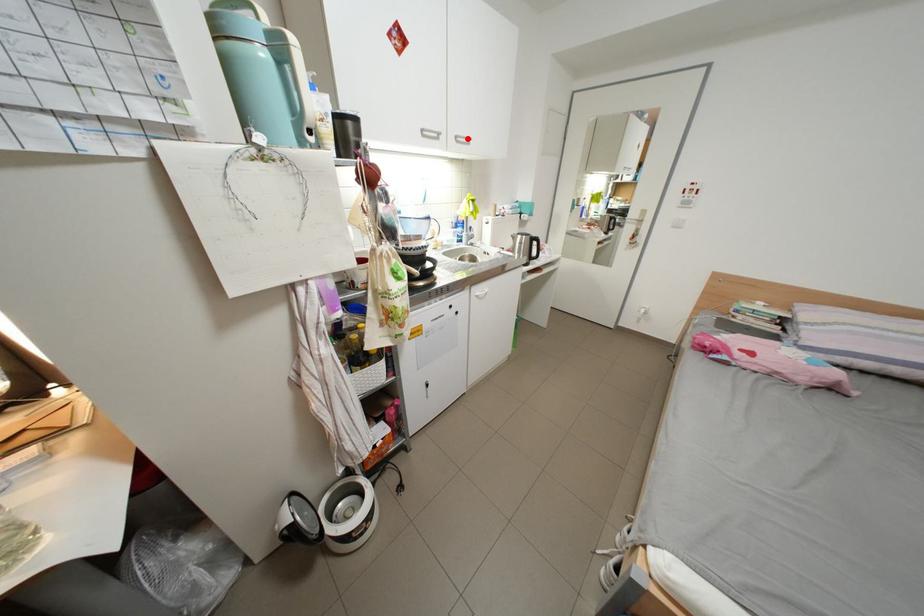
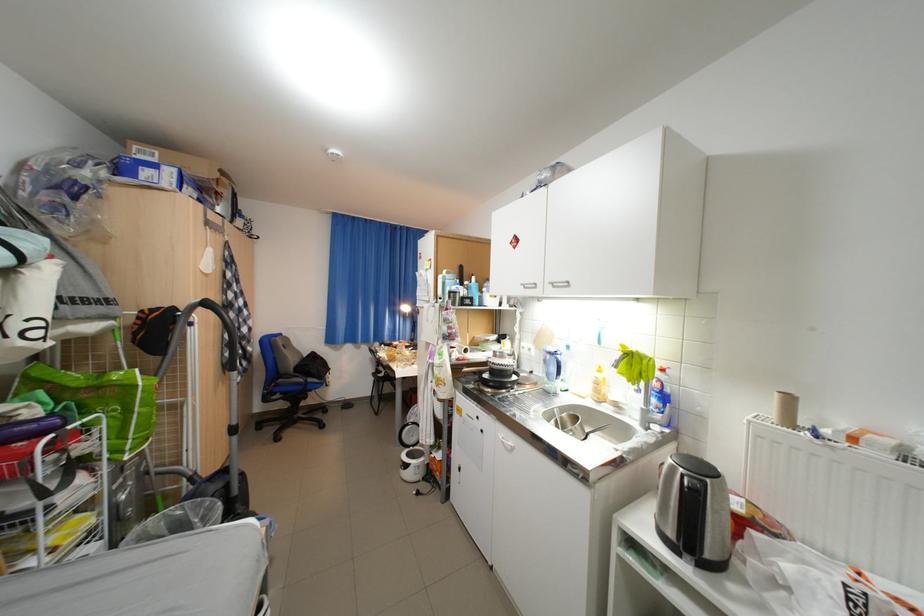
In the second image, find the point that corresponds to the highlighted location in the first image.

(564, 285)